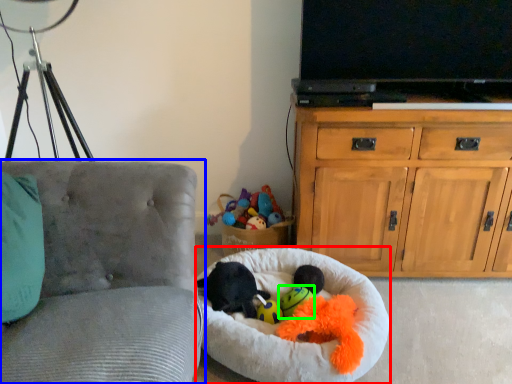
Question: Which object is positioned farthest from dog bed (highlighted by a red box)? Select from chair (highlighted by a blue box) and toy (highlighted by a green box).

Choices:
 (A) chair
 (B) toy

Answer: (A)